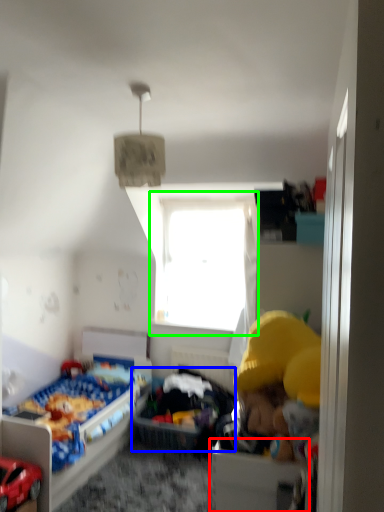
Question: Estimate the real-world distances between objects in this image. Which object is farther from drawer (highlighted by a red box), infant bed (highlighted by a blue box) or window (highlighted by a green box)?

Choices:
 (A) infant bed
 (B) window

Answer: (B)